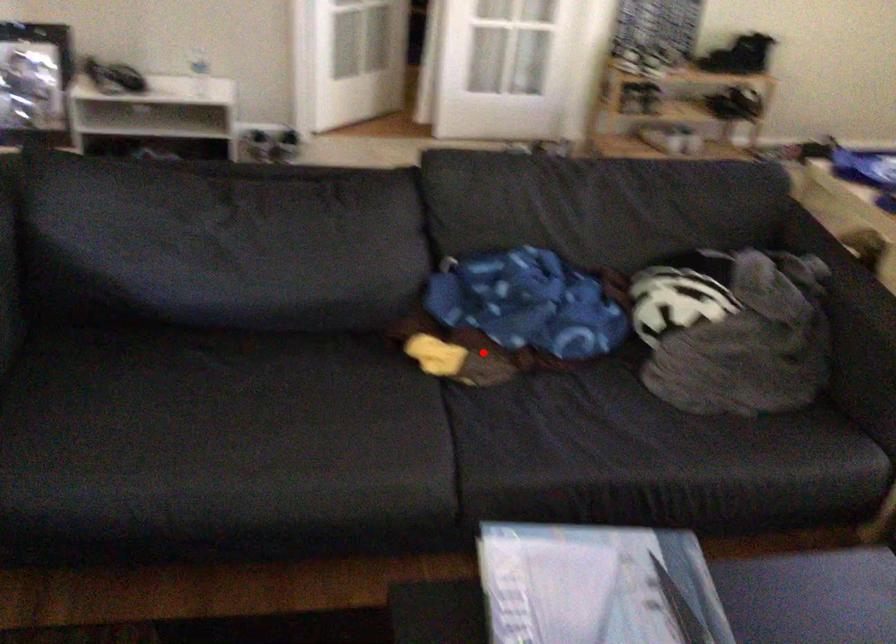
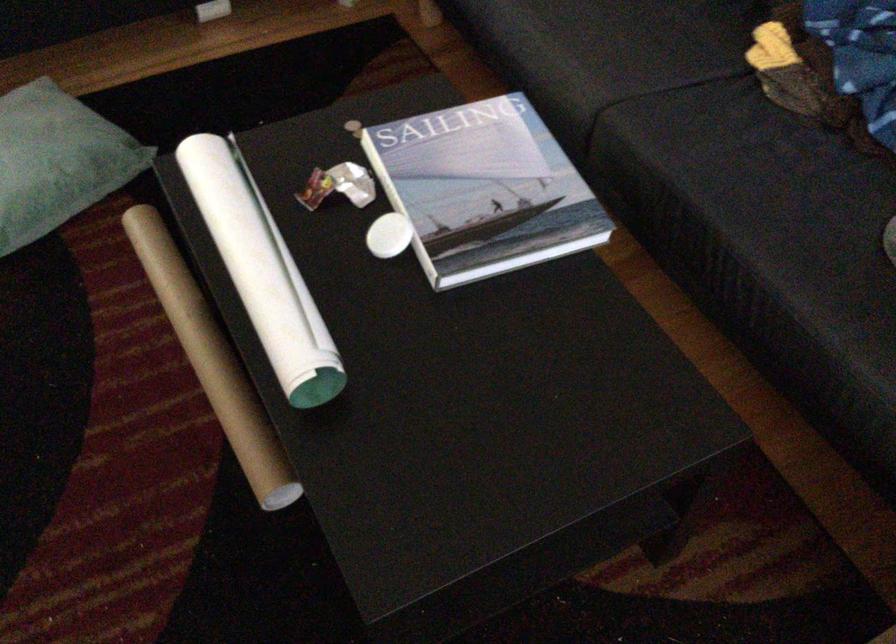
Locate, in the second image, the point that corresponds to the highlighted location in the first image.

(808, 77)